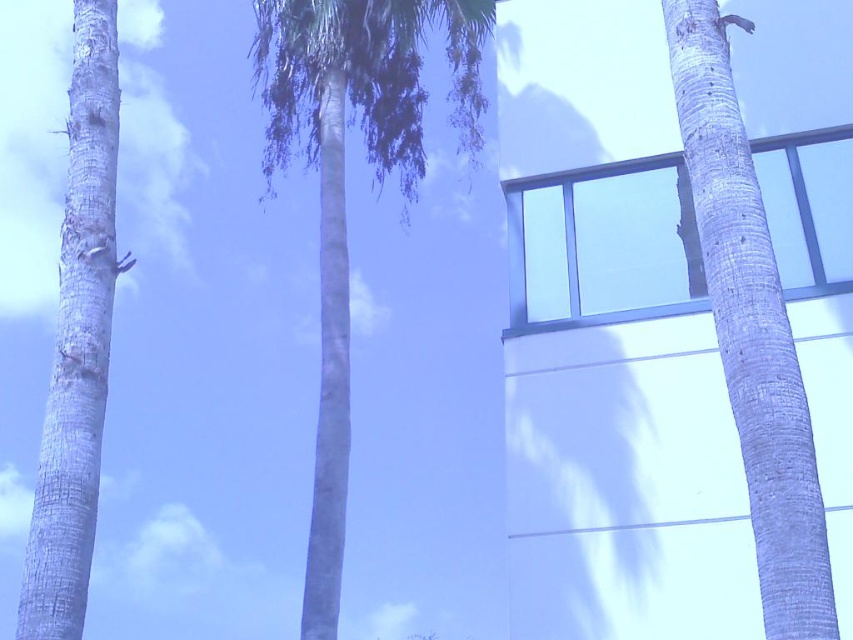
Can you confirm if smooth gray palm tree at center is positioned above smooth gray bark at left?

No.

Describe the element at coordinates (343, 184) in the screenshot. The width and height of the screenshot is (853, 640). I see `smooth gray palm tree at center` at that location.

Is point (343, 458) farther from camera compared to point (88, 12)?

Yes, point (343, 458) is farther from viewer.

Find the location of a particular element. The image size is (853, 640). smooth gray palm tree at center is located at coordinates (343, 184).

Can you confirm if smooth gray palm tree at center is bigger than smooth gray bark at right?

Incorrect, smooth gray palm tree at center is not larger than smooth gray bark at right.

Who is lower down, smooth gray palm tree at center or smooth gray bark at right?

smooth gray palm tree at center is lower down.

Locate an element on the screen. smooth gray palm tree at center is located at coordinates (343, 184).

Is smooth gray bark at right below smooth gray bark at left?

No.

Is point (786, 531) more distant than point (73, 58)?

No, (786, 531) is closer to viewer.

Between point (712, 97) and point (61, 588), which one is positioned in front?

Point (61, 588) is more forward.

Where is `smooth gray bark at right`? smooth gray bark at right is located at coordinates (751, 332).